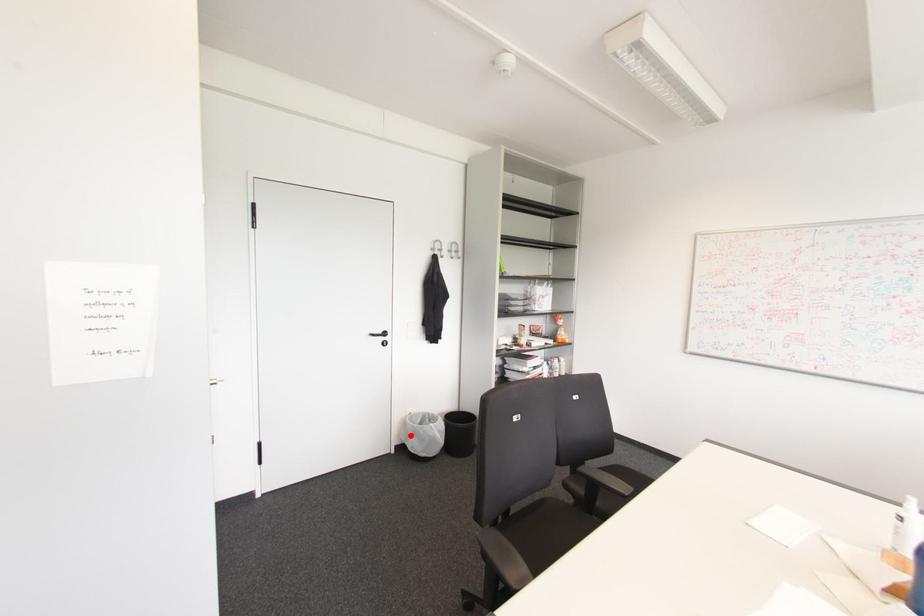
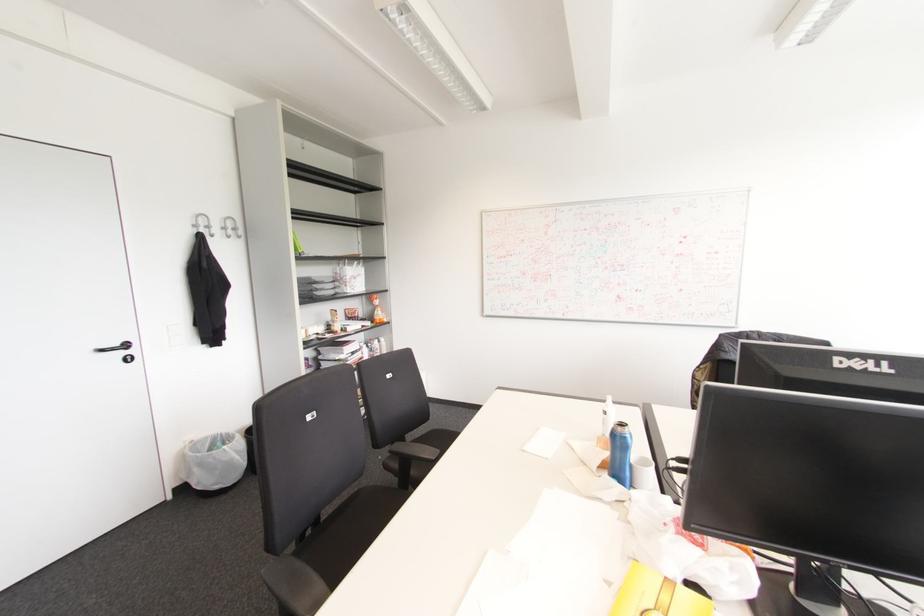
The point at the highlighted location is marked in the first image. Where is the corresponding point in the second image?

(195, 469)